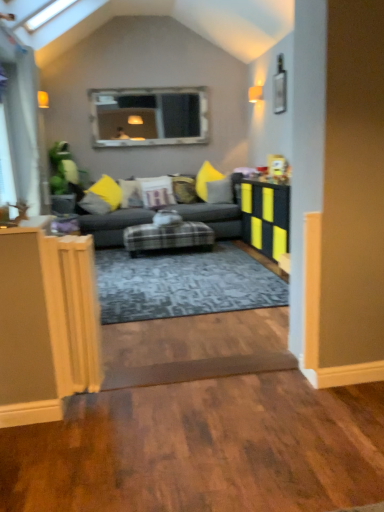
Question: Can we say velvet yellow pillow at center, arranged as the second pillow when viewed from the left, lies outside matte black table at right?

Choices:
 (A) no
 (B) yes

Answer: (B)

Question: From the image's perspective, would you say velvet yellow pillow at center, the 4th pillow in the right-to-left sequence, is positioned over matte black table at right?

Choices:
 (A) yes
 (B) no

Answer: (A)

Question: Considering the relative sizes of velvet yellow pillow at center, the 4th pillow in the right-to-left sequence, and matte black table at right in the image provided, is velvet yellow pillow at center, the 4th pillow in the right-to-left sequence, smaller than matte black table at right?

Choices:
 (A) no
 (B) yes

Answer: (B)

Question: Is velvet yellow pillow at center, arranged as the second pillow when viewed from the left, next to matte black table at right?

Choices:
 (A) no
 (B) yes

Answer: (A)

Question: From a real-world perspective, is velvet yellow pillow at center, the 4th pillow in the right-to-left sequence, on matte black table at right?

Choices:
 (A) no
 (B) yes

Answer: (B)

Question: Is the depth of velvet yellow pillow at center, arranged as the second pillow when viewed from the left, less than that of matte black table at right?

Choices:
 (A) yes
 (B) no

Answer: (B)

Question: Is plush gray couch at center thinner than transparent glass door at left?

Choices:
 (A) no
 (B) yes

Answer: (A)

Question: From a real-world perspective, does plush gray couch at center sit lower than transparent glass door at left?

Choices:
 (A) no
 (B) yes

Answer: (B)

Question: Would you say plush gray couch at center contains transparent glass door at left?

Choices:
 (A) yes
 (B) no

Answer: (B)

Question: Is plush gray couch at center further to the viewer compared to transparent glass door at left?

Choices:
 (A) no
 (B) yes

Answer: (B)

Question: Can you confirm if plush gray couch at center is smaller than transparent glass door at left?

Choices:
 (A) no
 (B) yes

Answer: (A)

Question: Considering the relative positions of plush gray couch at center and transparent glass door at left in the image provided, is plush gray couch at center to the right of transparent glass door at left from the viewer's perspective?

Choices:
 (A) no
 (B) yes

Answer: (B)

Question: Does matte black table at right appear on the right side of plush gray couch at center?

Choices:
 (A) yes
 (B) no

Answer: (A)